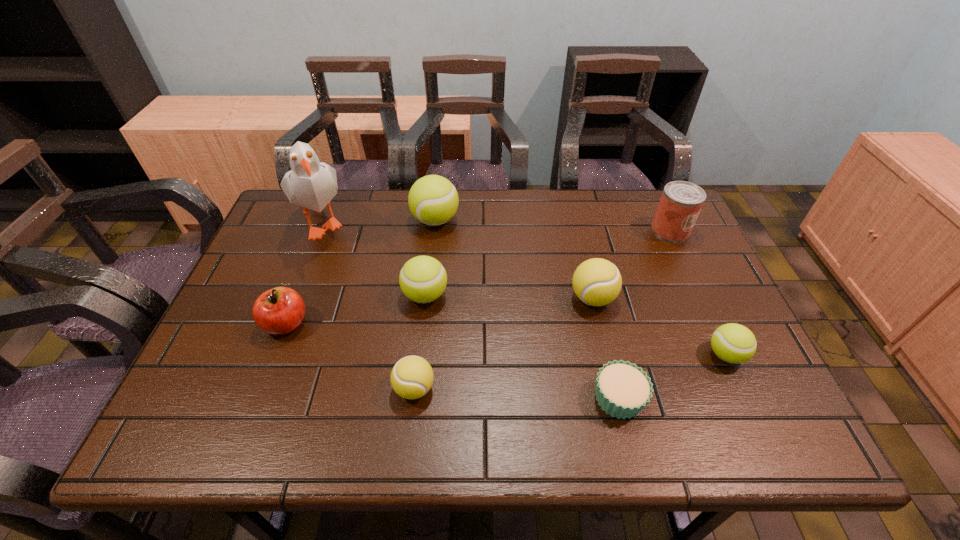
You are a GUI agent. You are given a task and a screenshot of the screen. Output one action in this format:
    pyautogui.click(x=<x>, y=<y>)
    Task: Click on the rightmost green tennis ball
    This screenshot has height=540, width=960.
    Given the screenshot: What is the action you would take?
    pyautogui.click(x=733, y=343)

Where is `the rightmost tennis ball`? the rightmost tennis ball is located at coordinates (733, 343).

This screenshot has height=540, width=960. In order to click on cupcake in this screenshot , I will do `click(622, 389)`.

Where is `free space located 0.130m at the beak of the gull`? free space located 0.130m at the beak of the gull is located at coordinates (296, 296).

The height and width of the screenshot is (540, 960). Identify the location of blank space located 0.190m on the left of the biggest green tennis ball. (349, 220).

Where is `blank area located 0.090m on the left of the can`? Image resolution: width=960 pixels, height=540 pixels. blank area located 0.090m on the left of the can is located at coordinates (622, 230).

Locate an element on the screen. The width and height of the screenshot is (960, 540). free space located on the back of the bigger yellow tennis ball is located at coordinates (578, 237).

Find the location of a particular element. This screenshot has height=540, width=960. vacant area located 0.270m on the front of the second nearest green tennis ball is located at coordinates (412, 414).

I want to click on free spot located on the right of the red apple, so click(x=362, y=324).

This screenshot has height=540, width=960. I want to click on vacant space located on the right of the nearer yellow tennis ball, so [x=578, y=388].